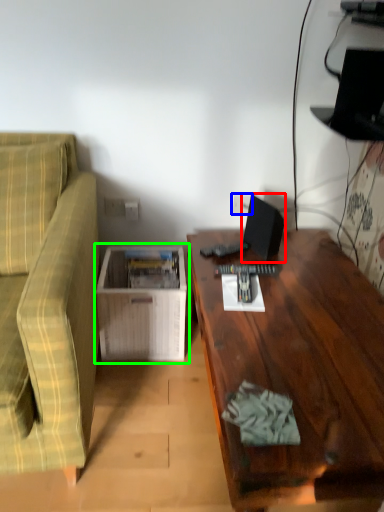
Question: Estimate the real-world distances between objects in this image. Which object is farther from computer monitor (highlighted by a red box), electric outlet (highlighted by a blue box) or table (highlighted by a green box)?

Choices:
 (A) electric outlet
 (B) table

Answer: (B)